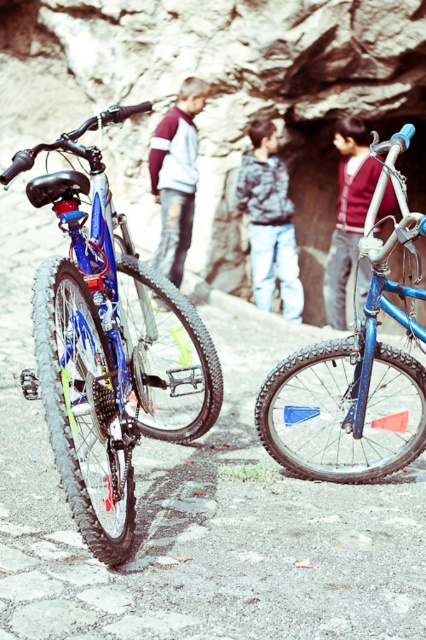
You are planning to transport both the shiny metallic bicycle at center and the blue matte bicycle at center via a pickup truck with a 1.5 meter wide bed. Can both bicycles fit side by side in the truck bed without overlapping?

The shiny metallic bicycle at center is smaller than the blue matte bicycle at center. To determine if both can fit side by side in the 1.5 meter wide truck bed, we need to know the combined width of both bicycles. However, since only their relative size is provided, we cannot confirm the exact widths. Without specific measurements, it is uncertain if they will fit.

You are a hiker who wants to take a photo of the shiny metallic bicycle at center from the path. Based on its position, can you estimate if you can reach it without leaving the cobblestone path?

The shiny metallic bicycle at center is located at point coordinates that are on the cobblestone path, so yes, you can reach it without leaving the path.

You are a hiker planning to take the blue matte mountain bike at center and the textured gray hoodie at center with you on a trail. Which item should you place in your backpack first to ensure it fits properly?

The blue matte mountain bike at center has a lesser height compared to the textured gray hoodie at center, so you should place the textured gray hoodie at center first as it is taller and needs to be at the bottom of the backpack.